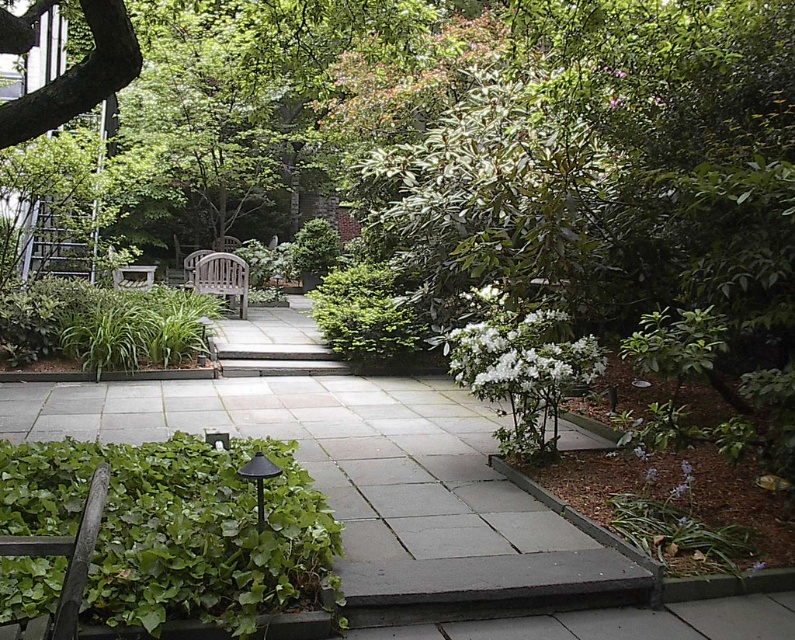
You are a gardener who needs to place a new decorative statue that is 1.2 meters tall. You have two options for placement based on the image. The first option is on the gray stone path at center, and the second is near the smooth brown bark at upper left. Considering the height of the existing objects, which location would allow the statue to be more visible from above? Explain your reasoning.

The smooth brown bark at upper left is shorter than the gray stone path at center. Wait, but the description says the gray stone path is not as tall as the smooth brown bark. Hmm, maybe I need to correct that. Let me check again. The Objects Description states that the gray stone path at center is not as tall as the smooth brown bark at upper left. So the smooth brown bark is taller. Therefore, placing the statue on the gray stone path, which is shorter, would make the statue more visible because it won tbe

You are standing at point [45,115] and want to walk to the garden entrance located at point [607,586]. Is the entrance directly in front of you or behind you?

The entrance at point [607,586] is in front of you because it is positioned in front of point [45,115] where you are standing.